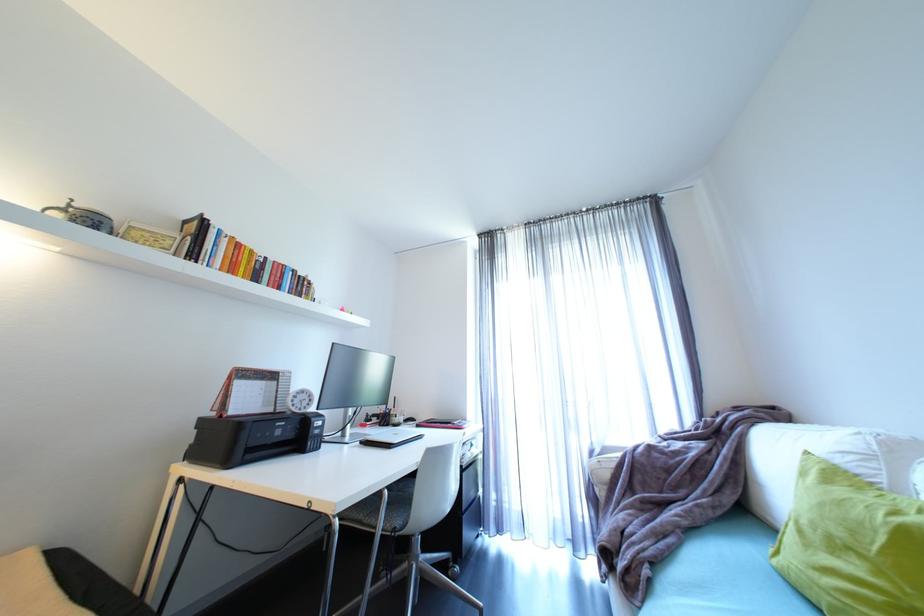
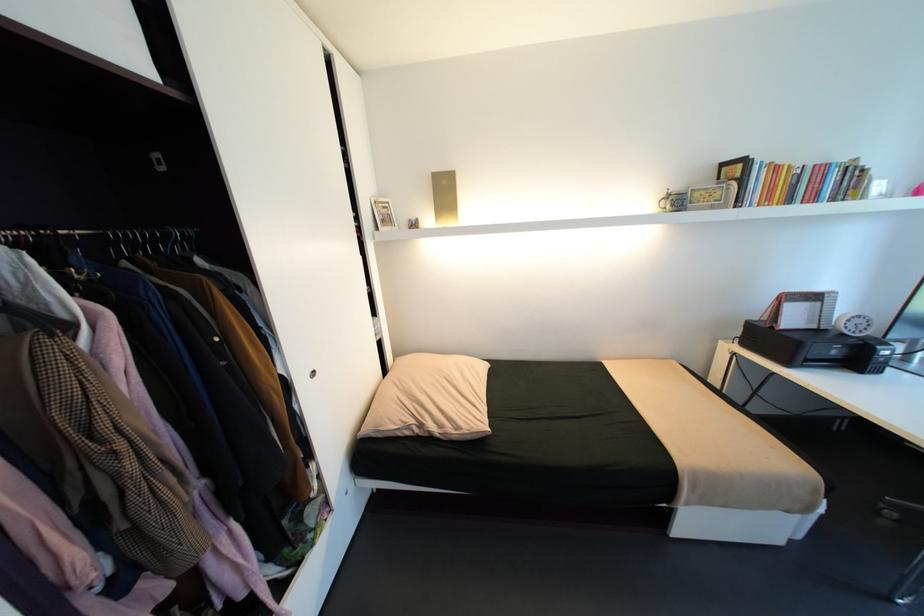
Where in the second image is the point corresponding to [228,416] from the first image?

(779, 328)